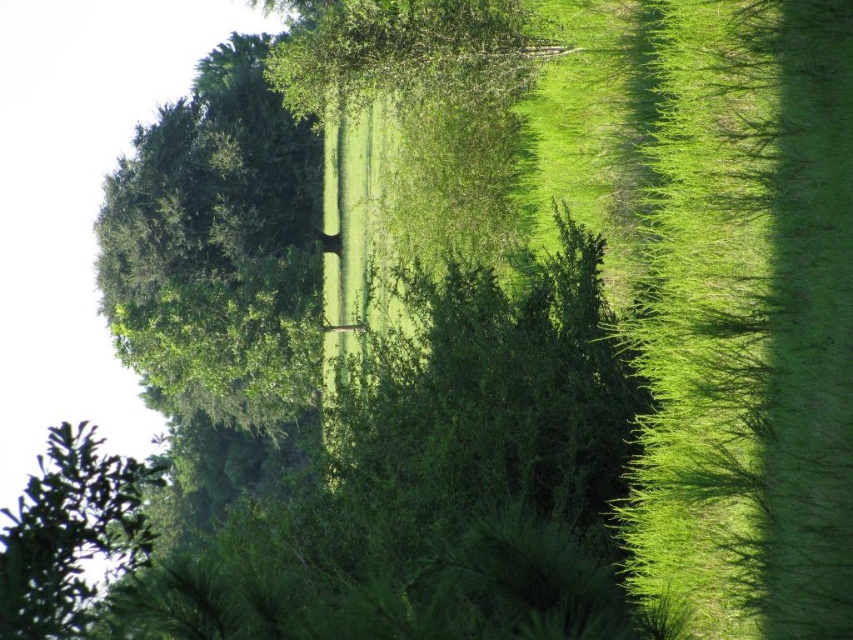
Which of these two, green leafy hedge at center or green leafy tree at upper left, stands taller?

green leafy hedge at center

Is point (521, 550) positioned before point (77, 605)?

No, it is behind (77, 605).

This screenshot has width=853, height=640. Describe the element at coordinates (434, 486) in the screenshot. I see `green leafy hedge at center` at that location.

Find the location of a particular element. This screenshot has width=853, height=640. green leafy hedge at center is located at coordinates (434, 486).